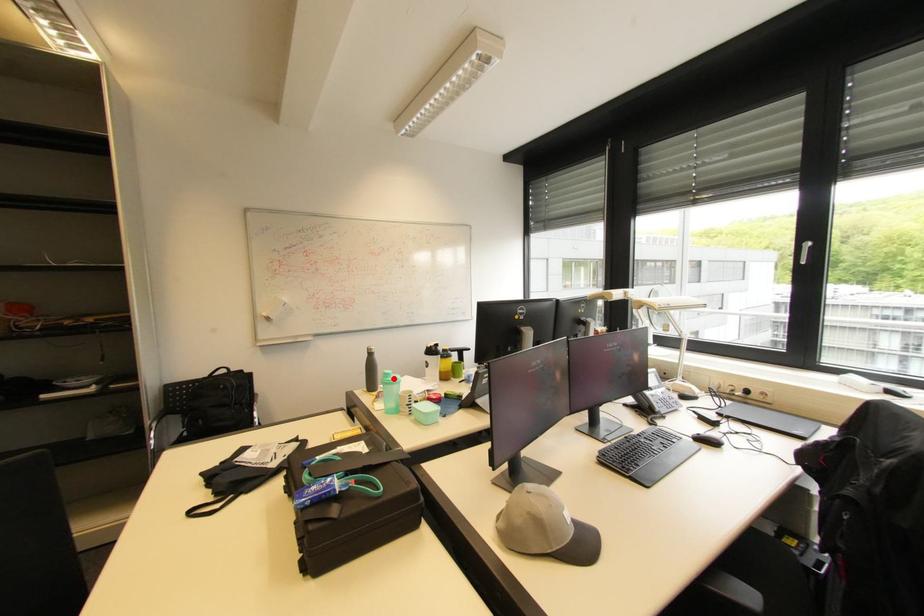
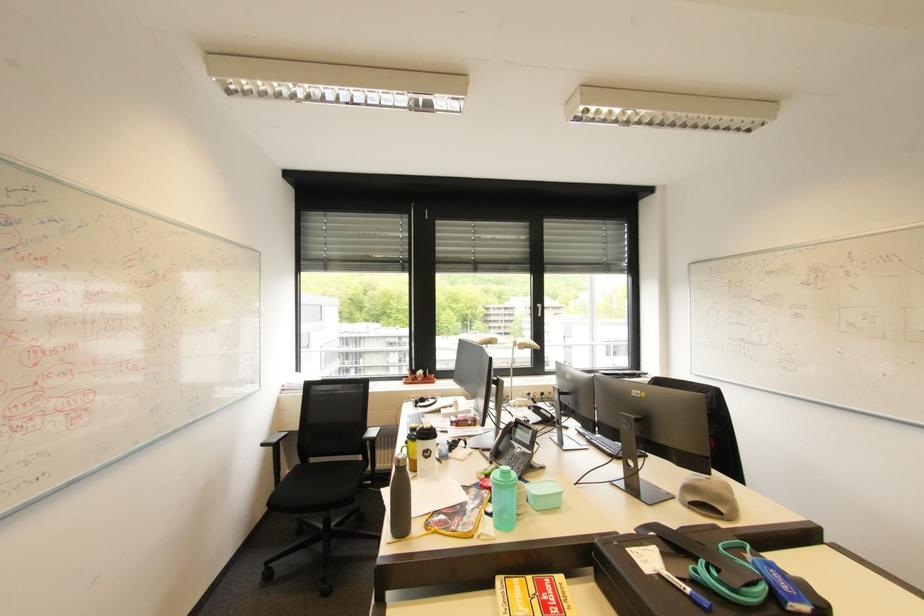
Question: I am providing you with two images of the same scene from different viewpoints. In image1, a red point is highlighted. Considering the same 3D point in image2, which of the following is correct?

Choices:
 (A) It is closer
 (B) It is farther

Answer: (A)